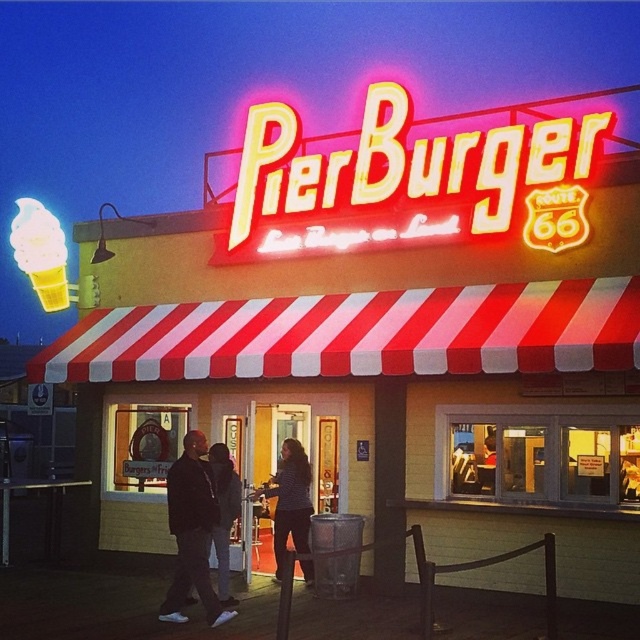
You are standing at the entrance of PierBurger diner and see two points marked on the ground. The first point is at coordinate point (x=502, y=168) and the second is at point (x=284, y=497). Which point is closer to you as you face the entrance?

Point (x=502, y=168) is in front of point (x=284, y=497), so it is closer to you as you face the entrance.